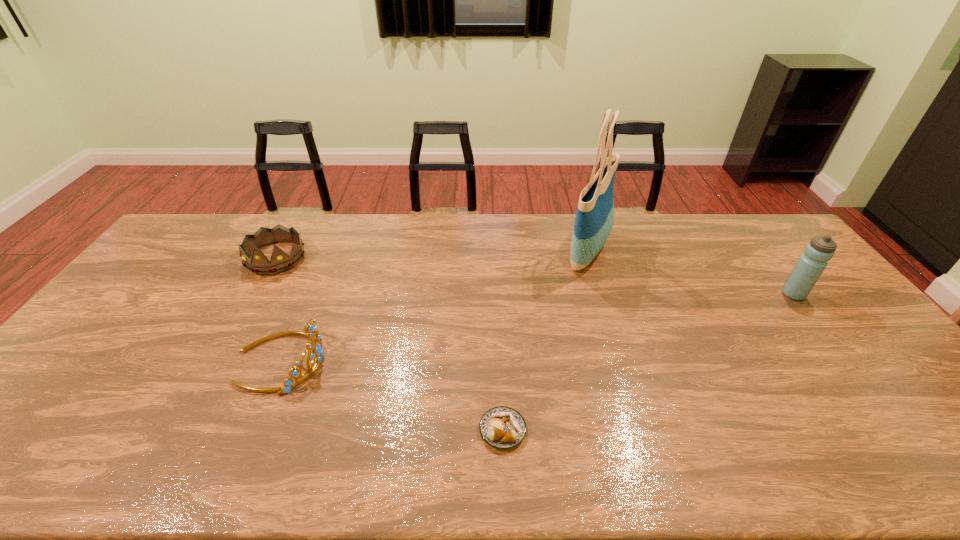
Image resolution: width=960 pixels, height=540 pixels. I want to click on vacant space located at the front of the farther tiara with jewels, so click(x=232, y=336).

The image size is (960, 540). What are the coordinates of `vacant space located 0.330m on the front-facing side of the fourth farthest object` in the screenshot? It's located at (448, 360).

Locate an element on the screen. Image resolution: width=960 pixels, height=540 pixels. free space located on the left of the pastry is located at coordinates (329, 430).

Locate an element on the screen. The image size is (960, 540). tote bag at the far edge is located at coordinates (594, 219).

Find the location of `tiara that is at the far edge`. tiara that is at the far edge is located at coordinates pos(280,261).

The image size is (960, 540). I want to click on object situated at the near edge, so click(x=501, y=427).

What are the coordinates of `object located in the right edge section of the desktop` in the screenshot? It's located at (811, 264).

Find the location of a particular element. The height and width of the screenshot is (540, 960). vacant space at the far edge is located at coordinates (439, 251).

Where is `free space at the near edge of the desktop`? This screenshot has width=960, height=540. free space at the near edge of the desktop is located at coordinates (593, 464).

Image resolution: width=960 pixels, height=540 pixels. Find the location of `vacant space at the left edge of the desktop`. vacant space at the left edge of the desktop is located at coordinates (33, 440).